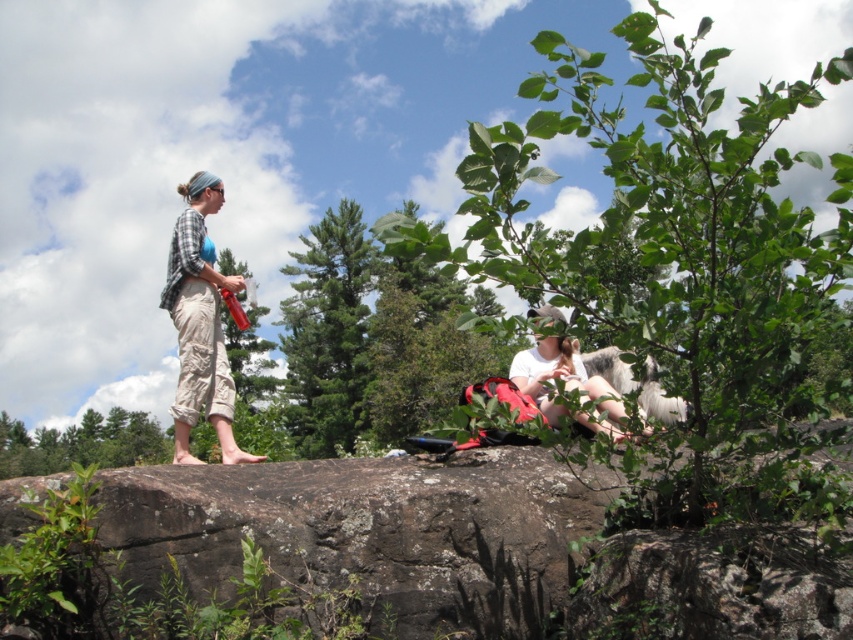
Question: Does brown rough rock at center have a smaller size compared to white cotton shirt at center?

Choices:
 (A) yes
 (B) no

Answer: (A)

Question: Which is nearer to the white cotton shirt at center?

Choices:
 (A) plaid shirt at left
 (B) brown rough rock at center

Answer: (B)

Question: Which point is farther to the camera?

Choices:
 (A) brown rough rock at center
 (B) plaid shirt at left
 (C) white cotton shirt at center

Answer: (B)

Question: Which object appears farthest from the camera in this image?

Choices:
 (A) plaid shirt at left
 (B) white cotton shirt at center

Answer: (A)

Question: Observing the image, what is the correct spatial positioning of brown rough rock at center in reference to white cotton shirt at center?

Choices:
 (A) below
 (B) above

Answer: (A)

Question: Where is plaid shirt at left located in relation to white cotton shirt at center in the image?

Choices:
 (A) below
 (B) above

Answer: (B)